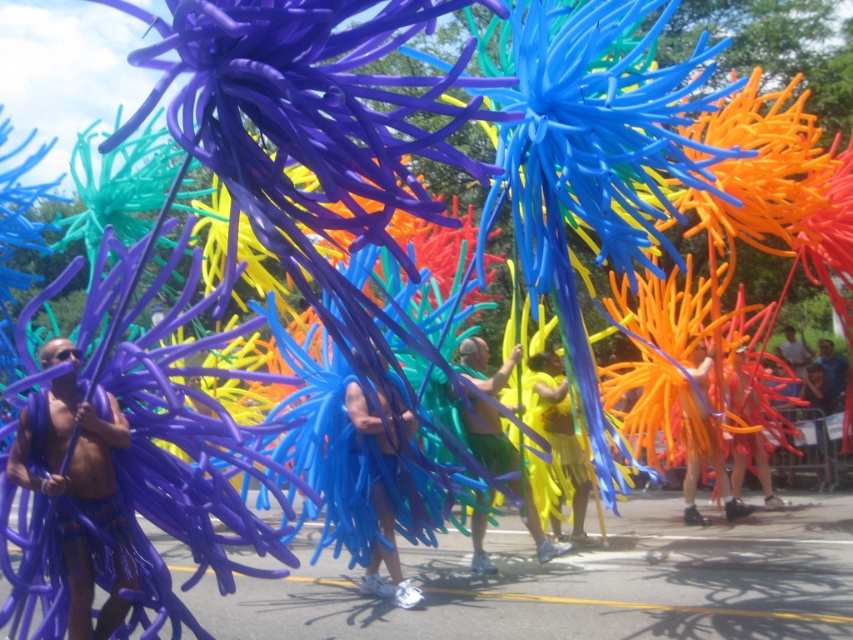
Is yellow matte fabric at center to the right of matte blue fabric at center from the viewer's perspective?

Correct, you'll find yellow matte fabric at center to the right of matte blue fabric at center.

Does point (479, 426) lie in front of point (380, 394)?

No, (479, 426) is behind (380, 394).

Locate an element on the screen. This screenshot has width=853, height=640. yellow matte fabric at center is located at coordinates click(486, 435).

Can you confirm if matte purple stick at left is positioned to the right of yellow matte fabric at center?

In fact, matte purple stick at left is to the left of yellow matte fabric at center.

Does matte purple stick at left have a greater width compared to yellow matte fabric at center?

No, matte purple stick at left is not wider than yellow matte fabric at center.

Is point (100, 502) closer to viewer compared to point (495, 392)?

Yes, point (100, 502) is in front of point (495, 392).

The image size is (853, 640). Find the location of `matte purple stick at left`. matte purple stick at left is located at coordinates (80, 492).

Who is shorter, matte purple stick at left or matte blue fabric at center?

Standing shorter between the two is matte purple stick at left.

Does matte purple stick at left lie behind matte blue fabric at center?

No.

Is point (82, 508) farther from viewer compared to point (352, 406)?

That is False.

Identify the location of matte purple stick at left. (80, 492).